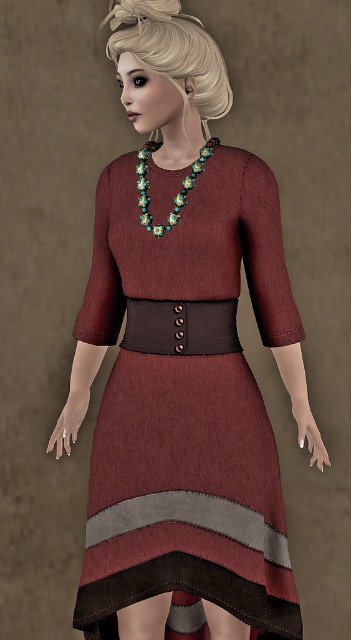
You are a fashion designer trying to create a cohesive outfit. You have a maroon woolen dress at center and a beaded floral necklace at center. Which item should you choose to be the focal point of the outfit, and why?

The maroon woolen dress at center should be the focal point because it has a larger size compared to the beaded floral necklace at center, making it more eye catching.

You are a fashion designer observing the image. You need to adjust the placement of the maroon woolen dress at center and the beaded floral necklace at center so that the necklace is positioned in front of the dress. Is this possible based on their current positions?

The maroon woolen dress at center is currently closer to the viewer than the beaded floral necklace at center. To position the necklace in front of the dress, you would need to move the necklace closer to the viewer so it overlaps the dress.